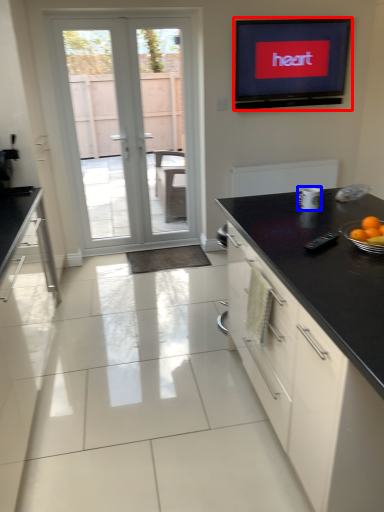
Question: Which of the following is the closest to the observer, electronic (highlighted by a red box) or appliance (highlighted by a blue box)?

Choices:
 (A) electronic
 (B) appliance

Answer: (B)